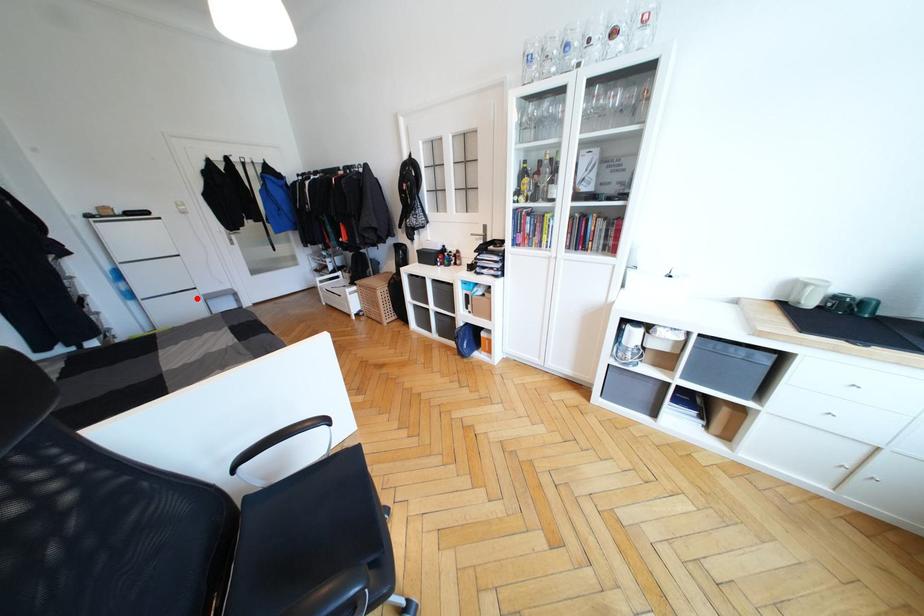
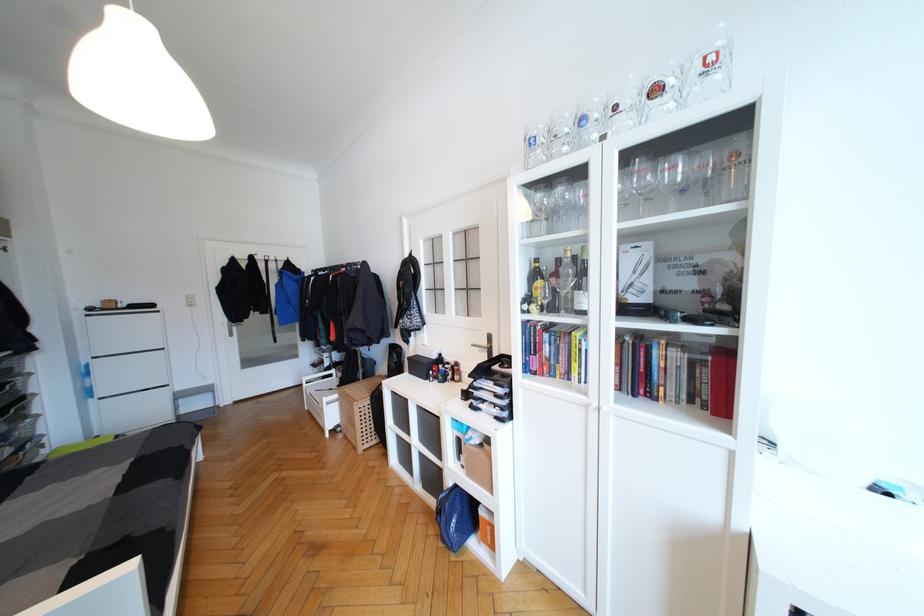
Find the pixel in the second image that matches the highlighted location in the first image.

(166, 397)